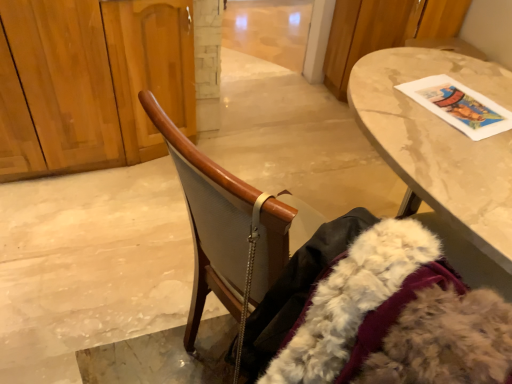
What do you see at coordinates (397, 319) in the screenshot? This screenshot has width=512, height=384. I see `white fluffy fur coat at lower right` at bounding box center [397, 319].

What do you see at coordinates (440, 143) in the screenshot? Image resolution: width=512 pixels, height=384 pixels. I see `marble table at upper right` at bounding box center [440, 143].

Describe the element at coordinates (254, 231) in the screenshot. I see `wooden chair at center` at that location.

The width and height of the screenshot is (512, 384). In order to click on wooden dresser at left in this screenshot , I will do `click(100, 77)`.

Who is shorter, wooden chair at center or wooden dresser at left?

wooden chair at center.

Is wooden chair at center smaller than wooden dresser at left?

Yes.

Can you confirm if wooden chair at center is wider than wooden dresser at left?

Correct, the width of wooden chair at center exceeds that of wooden dresser at left.

From a real-world perspective, between wooden dresser at left and white fluffy fur coat at lower right, who is vertically lower?

In real-world perspective, wooden dresser at left is lower.

Is wooden dresser at left next to white fluffy fur coat at lower right?

wooden dresser at left and white fluffy fur coat at lower right are clearly separated.

Is white fluffy fur coat at lower right at the back of wooden dresser at left?

wooden dresser at left is not turned away from white fluffy fur coat at lower right.

Is white fluffy fur coat at lower right bigger than wooden chair at center?

Yes, white fluffy fur coat at lower right is bigger than wooden chair at center.

From a real-world perspective, who is located higher, white fluffy fur coat at lower right or wooden chair at center?

wooden chair at center.

In the image, is white fluffy fur coat at lower right on the left side or the right side of wooden chair at center?

white fluffy fur coat at lower right is to the right of wooden chair at center.

In the scene shown: Is white fluffy fur coat at lower right turned away from wooden chair at center?

Yes, white fluffy fur coat at lower right is positioned with its back facing wooden chair at center.

Which of these two, white fluffy fur coat at lower right or wooden dresser at left, stands shorter?

With less height is wooden dresser at left.

Which object is positioned more to the right, white fluffy fur coat at lower right or wooden dresser at left?

From the viewer's perspective, white fluffy fur coat at lower right appears more on the right side.

Between white fluffy fur coat at lower right and wooden dresser at left, which one has larger size?

With larger size is wooden dresser at left.

Is white fluffy fur coat at lower right in front of wooden dresser at left?

That is True.

Considering the relative positions of white fluffy fur coat at lower right and marble table at upper right in the image provided, is white fluffy fur coat at lower right in front of marble table at upper right?

Yes, white fluffy fur coat at lower right is closer to the camera.

From the image's perspective, is white fluffy fur coat at lower right positioned above or below marble table at upper right?

Based on their image positions, white fluffy fur coat at lower right is located beneath marble table at upper right.

Could marble table at upper right be considered to be inside white fluffy fur coat at lower right?

Definitely not — marble table at upper right is not inside white fluffy fur coat at lower right.

Who is shorter, white fluffy fur coat at lower right or marble table at upper right?

Standing shorter between the two is marble table at upper right.

Locate an element on the screen. chair lying in front of the white fluffy fur coat at lower right is located at coordinates (254, 231).

Is wooden chair at center taller or shorter than white fluffy fur coat at lower right?

In the image, wooden chair at center appears to be shorter than white fluffy fur coat at lower right.

From a real-world perspective, between wooden chair at center and white fluffy fur coat at lower right, who is vertically lower?

white fluffy fur coat at lower right.

Considering the positions of objects marble table at upper right and wooden chair at center in the image provided, who is more to the right, marble table at upper right or wooden chair at center?

marble table at upper right is more to the right.

Is the position of marble table at upper right less distant than that of wooden chair at center?

No, marble table at upper right is behind wooden chair at center.

From a real-world perspective, which object stands above the other?

wooden chair at center is physically above.

What are the coordinates of `chair below the wooden dresser at left (from the image's perspective)` in the screenshot? It's located at (254, 231).

At what (x,y) coordinates should I click in order to perform the action: click on dresser lying behind the white fluffy fur coat at lower right. Please return your answer as a coordinate pair (x, y). Looking at the image, I should click on (100, 77).

Which object lies further to the anchor point wooden chair at center, wooden dresser at left or white fluffy fur coat at lower right?

wooden dresser at left is positioned further to the anchor wooden chair at center.

When comparing their distances from wooden chair at center, does marble table at upper right or white fluffy fur coat at lower right seem closer?

white fluffy fur coat at lower right.

Considering their positions, is white fluffy fur coat at lower right positioned closer to wooden dresser at left than marble table at upper right?

Based on the image, marble table at upper right appears to be nearer to wooden dresser at left.

From the image, which object appears to be nearer to marble table at upper right, wooden chair at center or wooden dresser at left?

wooden chair at center is closer to marble table at upper right.

Looking at the image, which one is located further to wooden dresser at left, marble table at upper right or wooden chair at center?

The object further to wooden dresser at left is marble table at upper right.

When comparing their distances from white fluffy fur coat at lower right, does wooden chair at center or wooden dresser at left seem further?

wooden dresser at left is positioned further to the anchor white fluffy fur coat at lower right.

Estimate the real-world distances between objects in this image. Which object is closer to marble table at upper right, white fluffy fur coat at lower right or wooden dresser at left?

white fluffy fur coat at lower right.

Which object lies further to the anchor point wooden chair at center, wooden dresser at left or marble table at upper right?

Based on the image, wooden dresser at left appears to be further to wooden chair at center.

Locate an element on the screen. Image resolution: width=512 pixels, height=384 pixels. chair between wooden dresser at left and marble table at upper right is located at coordinates (254, 231).

I want to click on fur coat situated between wooden dresser at left and marble table at upper right from left to right, so click(x=397, y=319).

In order to click on fur coat located between wooden chair at center and wooden dresser at left in the depth direction in this screenshot , I will do `click(397, 319)`.

This screenshot has width=512, height=384. What are the coordinates of `fur coat situated between wooden chair at center and marble table at upper right from left to right` in the screenshot? It's located at coord(397,319).